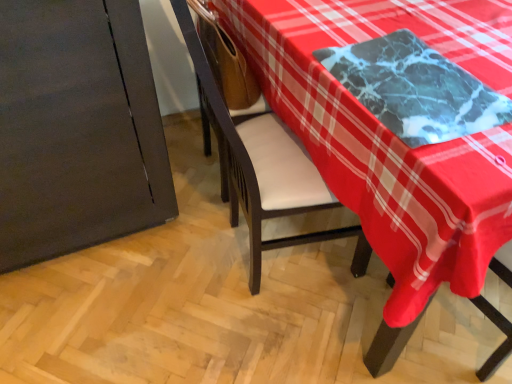
Question: From a real-world perspective, is wooden armchair at center positioned above or below marble table at upper right?

Choices:
 (A) above
 (B) below

Answer: (A)

Question: Is wooden armchair at center in front of or behind marble table at upper right in the image?

Choices:
 (A) front
 (B) behind

Answer: (B)

Question: Based on their relative distances, which object is nearer to the marble-like black tray at upper right?

Choices:
 (A) wooden armchair at center
 (B) marble table at upper right

Answer: (B)

Question: Based on their relative distances, which object is farther from the wooden armchair at center?

Choices:
 (A) marble-like black tray at upper right
 (B) marble table at upper right

Answer: (A)